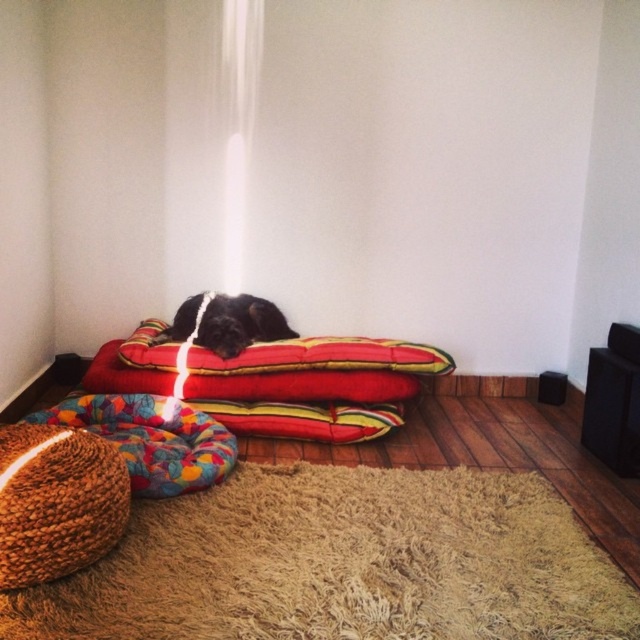
Is soft beige carpet at center positioned in front of brown knitted bean bag chair at lower left?

Yes, soft beige carpet at center is in front of brown knitted bean bag chair at lower left.

Does point (344, 554) come farther from viewer compared to point (60, 490)?

Yes, point (344, 554) is farther from viewer.

Where is `soft beige carpet at center`? soft beige carpet at center is located at coordinates (342, 563).

Is point (124, 563) positioned in front of point (264, 332)?

Yes, point (124, 563) is in front of point (264, 332).

Does point (444, 506) come closer to viewer compared to point (266, 300)?

That is True.

Locate an element on the screen. This screenshot has width=640, height=640. soft beige carpet at center is located at coordinates (342, 563).

Between point (81, 509) and point (99, 413), which one is positioned in front?

Point (81, 509) is in front.

Is brown knitted bean bag chair at lower left further to camera compared to multicolored fabric dog bed at lower left?

No, it is in front of multicolored fabric dog bed at lower left.

This screenshot has width=640, height=640. I want to click on brown knitted bean bag chair at lower left, so click(x=58, y=500).

Where is `brown knitted bean bag chair at lower left`? brown knitted bean bag chair at lower left is located at coordinates [x=58, y=500].